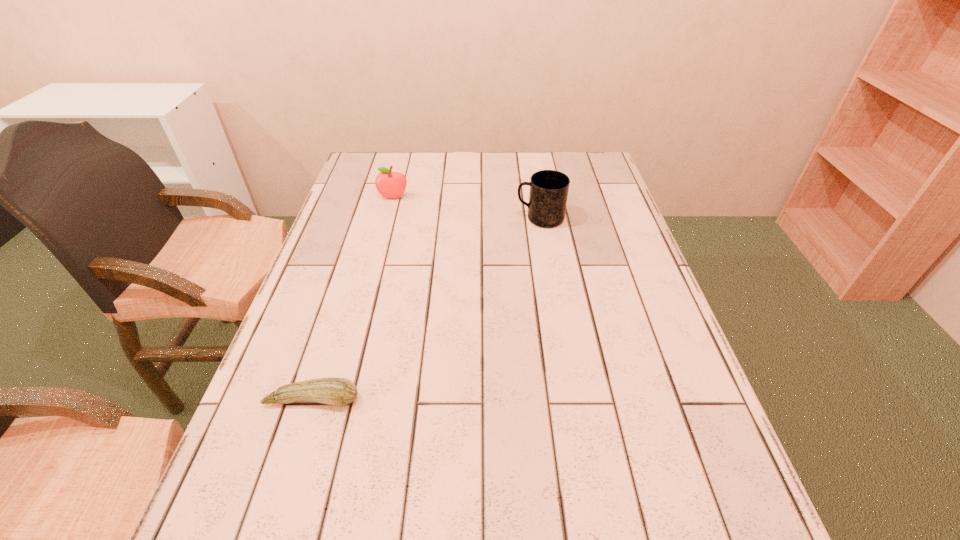
You are a GUI agent. You are given a task and a screenshot of the screen. Output one action in this format:
    pyautogui.click(x=<x>, y=<y>)
    Task: Click on the unoccupied position between the mug and the farthest object
    Image resolution: width=960 pixels, height=540 pixels.
    Given the screenshot: What is the action you would take?
    pyautogui.click(x=467, y=208)

Find the location of a particular element. free space between the second nearest object and the nearest object is located at coordinates (426, 309).

Find the location of `free space between the second tallest object and the rightmost object`. free space between the second tallest object and the rightmost object is located at coordinates (467, 208).

This screenshot has width=960, height=540. I want to click on free space between the nearest object and the second tallest object, so click(353, 299).

Where is `object that ranks as the closest to the rightmost object`? The width and height of the screenshot is (960, 540). object that ranks as the closest to the rightmost object is located at coordinates (389, 184).

Identify the location of the closest object to the second shortest object. (549, 189).

Locate an element on the screen. This screenshot has height=540, width=960. blank area in the image that satisfies the following two spatial constraints: 1. on the side of the second nearest object with the handle; 2. at the stem end of the zucchini is located at coordinates [x=570, y=399].

Identify the location of vacant position in the image that satisfies the following two spatial constraints: 1. on the side of the mug with the handle; 2. at the stem end of the zucchini. (570, 399).

I want to click on free space in the image that satisfies the following two spatial constraints: 1. on the side of the rightmost object with the handle; 2. at the stem end of the nearest object, so click(570, 399).

Identify the location of blank area in the image that satisfies the following two spatial constraints: 1. on the side of the rightmost object with the handle; 2. at the stem end of the nearest object. (570, 399).